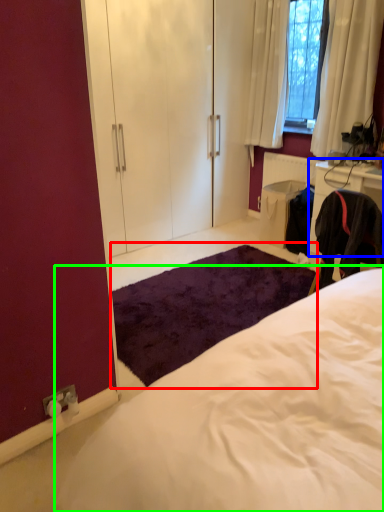
Question: Estimate the real-world distances between objects in this image. Which object is closer to mat (highlighted by a red box), cabinetry (highlighted by a blue box) or bed (highlighted by a green box)?

Choices:
 (A) cabinetry
 (B) bed

Answer: (A)